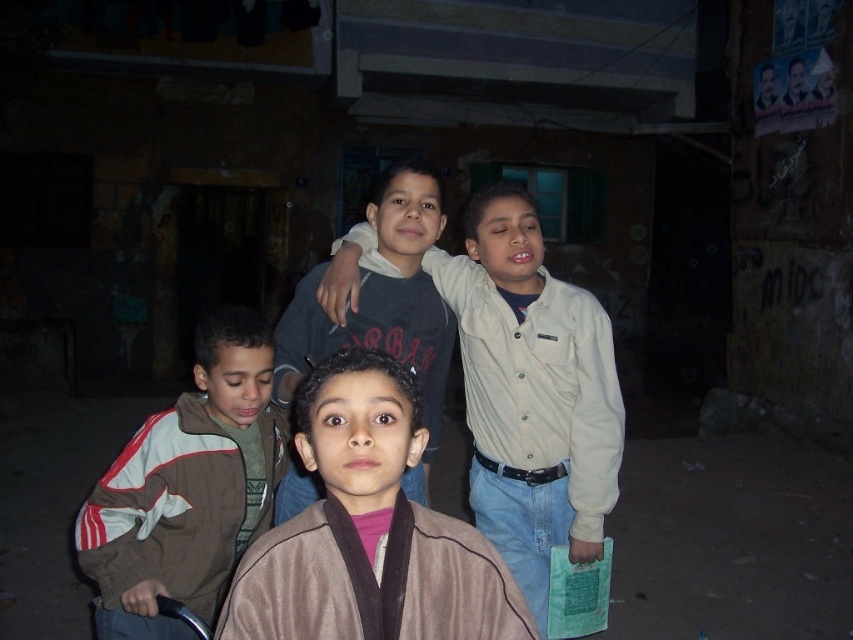
Question: Does light beige shirt at center appear over brown fleece jacket at lower left?

Choices:
 (A) yes
 (B) no

Answer: (A)

Question: Which of the following is the farthest from the observer?

Choices:
 (A) brown fleece jacket at lower left
 (B) light beige shirt at center

Answer: (B)

Question: Considering the real-world distances, which object is farthest from the light beige shirt at center?

Choices:
 (A) brown fleece jacket at lower left
 (B) brown suede jacket at center

Answer: (B)

Question: Is light beige shirt at center to the right of brown fleece jacket at lower left from the viewer's perspective?

Choices:
 (A) yes
 (B) no

Answer: (A)

Question: Is brown suede jacket at center closer to camera compared to brown fleece jacket at lower left?

Choices:
 (A) no
 (B) yes

Answer: (B)

Question: Among these points, which one is farthest from the camera?

Choices:
 (A) (479, 205)
 (B) (227, 566)

Answer: (A)